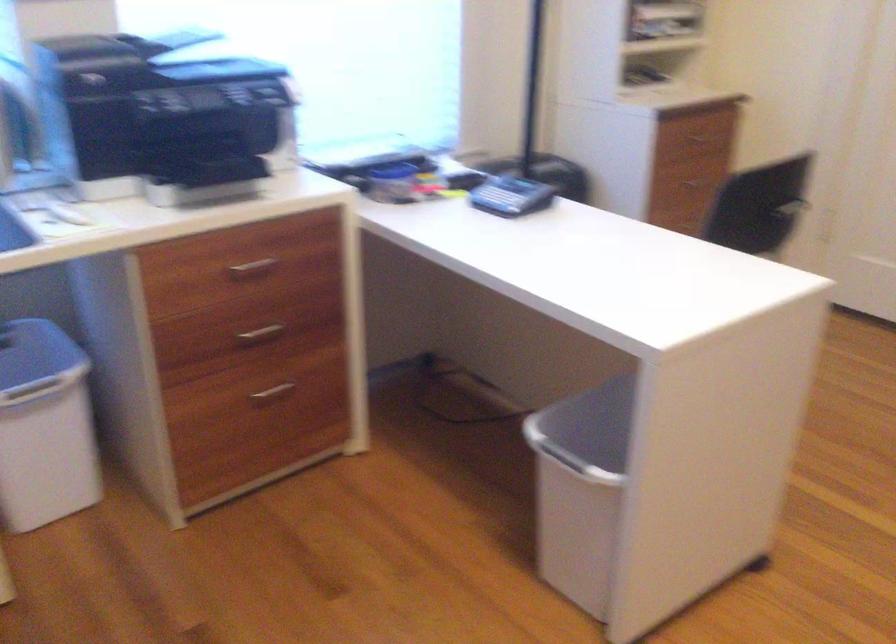
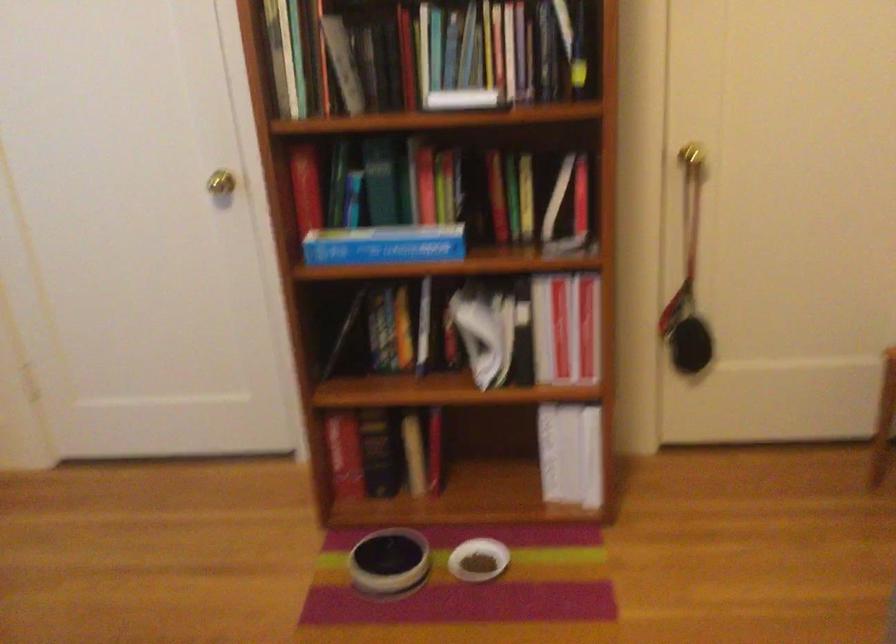
Question: The camera is either moving clockwise (left) or counter-clockwise (right) around the object. The first image is from the beginning of the video and the second image is from the end. Is the camera moving left or right when shooting the video?

Choices:
 (A) Left
 (B) Right

Answer: (A)